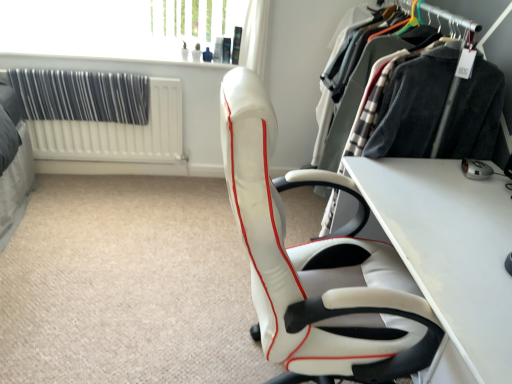
Question: Is white leather chair at center turned away from white textured radiator at left?

Choices:
 (A) no
 (B) yes

Answer: (A)

Question: Can you confirm if white leather chair at center is positioned to the left of white textured radiator at left?

Choices:
 (A) no
 (B) yes

Answer: (A)

Question: Could white textured radiator at left be considered to be inside white leather chair at center?

Choices:
 (A) no
 (B) yes

Answer: (A)

Question: Is white leather chair at center smaller than white textured radiator at left?

Choices:
 (A) yes
 (B) no

Answer: (B)

Question: Does white leather chair at center have a greater width compared to white textured radiator at left?

Choices:
 (A) no
 (B) yes

Answer: (B)

Question: Looking at their shapes, would you say silver metallic mouse at lower right is wider or thinner than white leather chair at center?

Choices:
 (A) wide
 (B) thin

Answer: (B)

Question: Looking at the image, does silver metallic mouse at lower right seem bigger or smaller compared to white leather chair at center?

Choices:
 (A) big
 (B) small

Answer: (B)

Question: From a real-world perspective, is silver metallic mouse at lower right above or below white leather chair at center?

Choices:
 (A) below
 (B) above

Answer: (B)

Question: Would you say silver metallic mouse at lower right is inside or outside white leather chair at center?

Choices:
 (A) outside
 (B) inside

Answer: (A)

Question: Is point (138, 122) closer or farther from the camera than point (474, 173)?

Choices:
 (A) farther
 (B) closer

Answer: (A)

Question: Considering the positions of black fabric curtain at upper left and silver metallic mouse at lower right in the image, is black fabric curtain at upper left taller or shorter than silver metallic mouse at lower right?

Choices:
 (A) tall
 (B) short

Answer: (A)

Question: Which is correct: black fabric curtain at upper left is inside silver metallic mouse at lower right, or outside of it?

Choices:
 (A) outside
 (B) inside

Answer: (A)

Question: From a real-world perspective, relative to silver metallic mouse at lower right, is black fabric curtain at upper left vertically above or below?

Choices:
 (A) below
 (B) above

Answer: (A)

Question: Is white textured radiator at left spatially inside white glossy table at center, or outside of it?

Choices:
 (A) inside
 (B) outside

Answer: (B)

Question: From a real-world perspective, is white textured radiator at left physically located above or below white glossy table at center?

Choices:
 (A) above
 (B) below

Answer: (B)